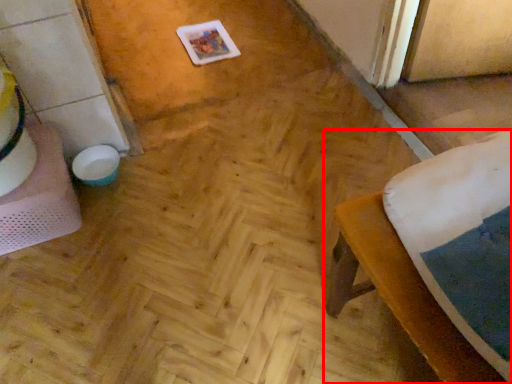
Question: From the image, what is the correct spatial relationship of furniture (annotated by the red box) in relation to table?

Choices:
 (A) left
 (B) right

Answer: (B)